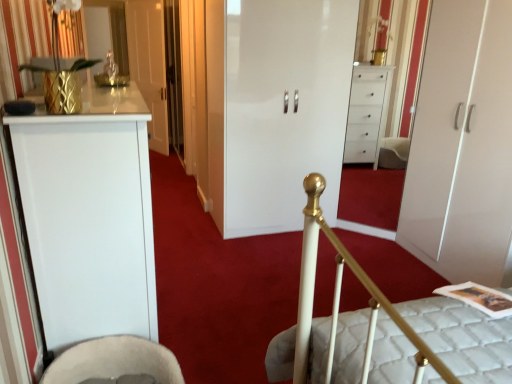
Question: Is point (138, 362) closer or farther from the camera than point (389, 316)?

Choices:
 (A) closer
 (B) farther

Answer: (B)

Question: Considering the positions of beige fabric rocking chair at lower left and white quilted mattress at center in the image, is beige fabric rocking chair at lower left taller or shorter than white quilted mattress at center?

Choices:
 (A) tall
 (B) short

Answer: (B)

Question: Considering the real-world distances, which object is farthest from the beige fabric rocking chair at lower left?

Choices:
 (A) white glossy cabinet at center, the second door from the right
 (B) white glossy wardrobe at center, acting as the 1th door starting from the front
 (C) white quilted mattress at center
 (D) gold textured pineapple at upper left
 (E) white glossy door at upper left, which is the 3th door from front to back

Answer: (E)

Question: Based on their relative distances, which object is nearer to the beige fabric rocking chair at lower left?

Choices:
 (A) white quilted mattress at center
 (B) white glossy cabinet at center, placed as the 2th door when sorted from front to back
 (C) gold textured pineapple at upper left
 (D) white glossy wardrobe at center, acting as the 3th door starting from the back
 (E) white glossy door at upper left, the first door viewed from the left

Answer: (A)